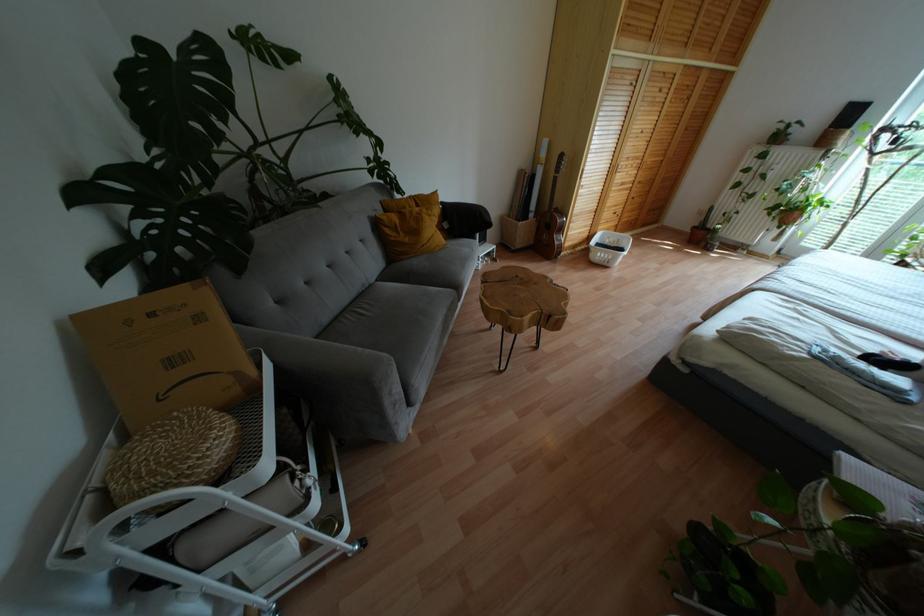
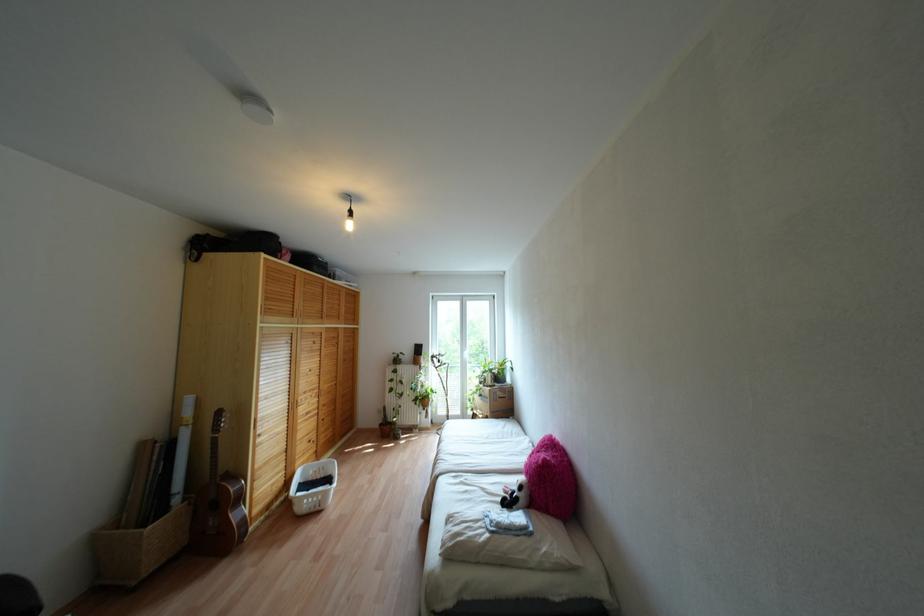
The point at [833,331] is marked in the first image. Where is the corresponding point in the second image?

(482, 488)